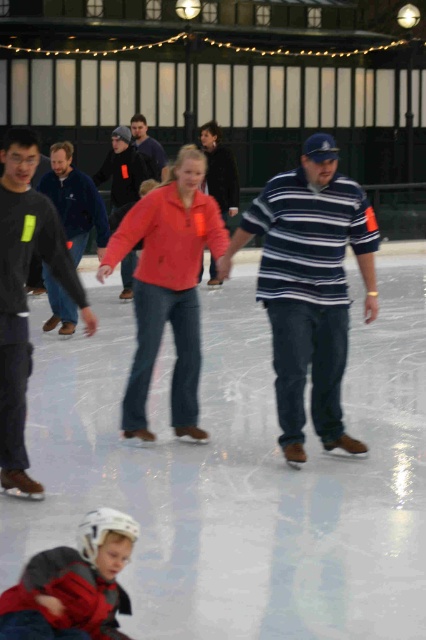
Question: Which point is farther from the camera taking this photo?

Choices:
 (A) (321, 410)
 (B) (46, 252)
 (C) (141, 360)

Answer: (C)

Question: Which object is the farthest from the orange fleece jacket at center?

Choices:
 (A) striped cotton shirt at center
 (B) matte pink jacket at center
 (C) matte black jacket at center

Answer: (A)

Question: Can you confirm if matte brown ice skates at center is wider than dark gray sweater at left?

Choices:
 (A) no
 (B) yes

Answer: (B)

Question: Does red matte jacket at center appear over orange fleece jacket at center?

Choices:
 (A) no
 (B) yes

Answer: (A)

Question: Which point is farther from the camera taking this photo?

Choices:
 (A) (268, 236)
 (B) (109, 168)
 (C) (40, 202)

Answer: (B)

Question: Is dark gray sweater at left smaller than matte blue jacket at center?

Choices:
 (A) no
 (B) yes

Answer: (A)